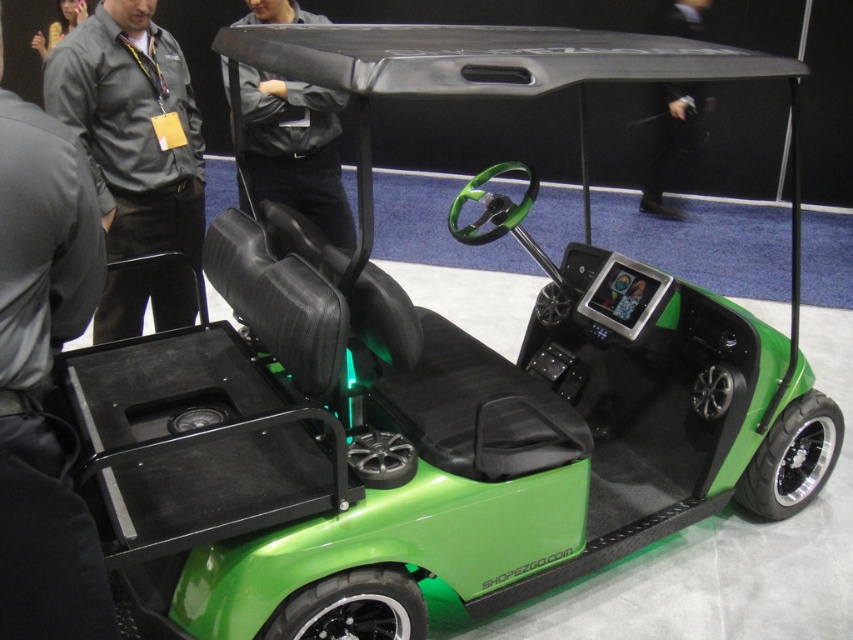
In the scene shown: You are at a trade show and want to place a new accessory between the dark gray uniform at left and the black leather jacket at upper center. Based on their positions, where should you place the accessory?

The dark gray uniform at left is to the left of the black leather jacket at upper center, so you should place the accessory between them, to the right of the dark gray uniform at left and to the left of the black leather jacket at upper center.

You are a security guard at the exhibition and need to walk from the dark gray uniform at left to the black leather jacket at center. What is the minimum distance you must cover?

The minimum distance you must cover is 1.42 meters between dark gray uniform at left and black leather jacket at center.

You are at a trade show and notice two items displayed on a table in front of the golf cart. One is a gray fabric shirt at upper left and the other is a black leather jacket at upper center. Which item is positioned more to the left?

The gray fabric shirt at upper left is positioned more to the left than the black leather jacket at upper center.